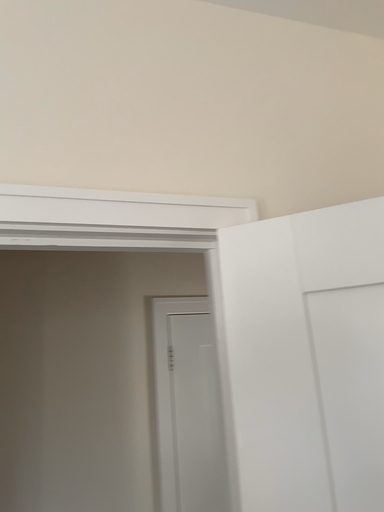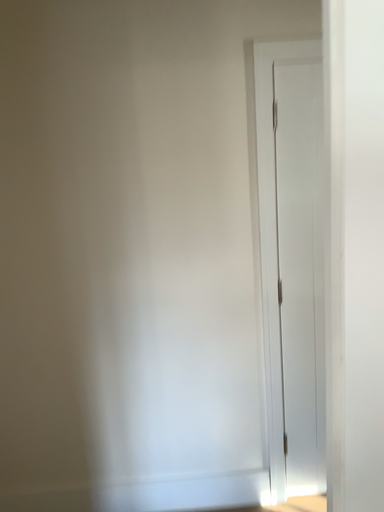
Question: Which way did the camera rotate in the video?

Choices:
 (A) rotated right
 (B) rotated left

Answer: (B)